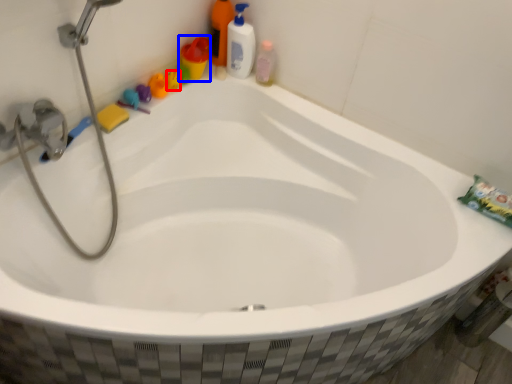
Question: Which point is further to the camera, toy (highlighted by a red box) or toiletry (highlighted by a blue box)?

Choices:
 (A) toy
 (B) toiletry

Answer: (A)